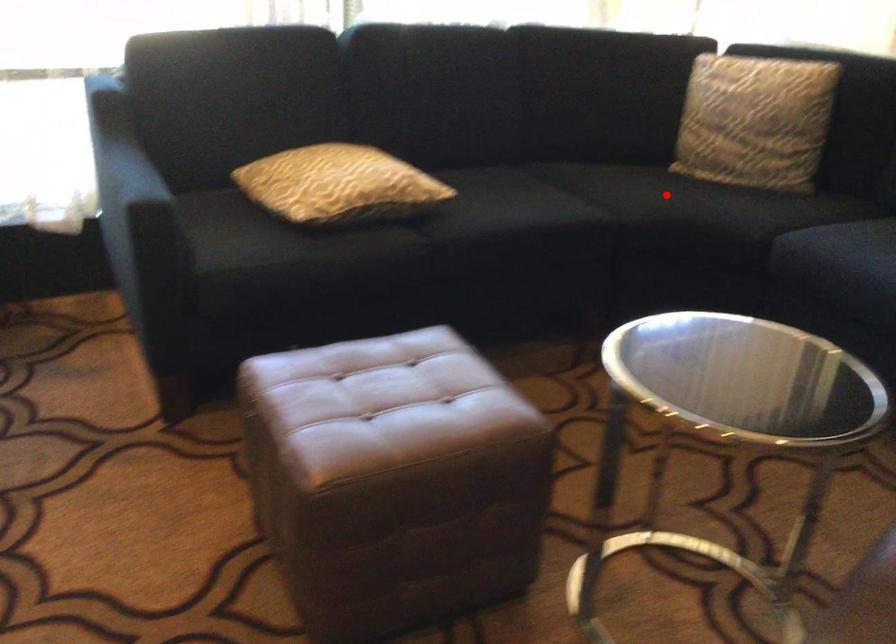
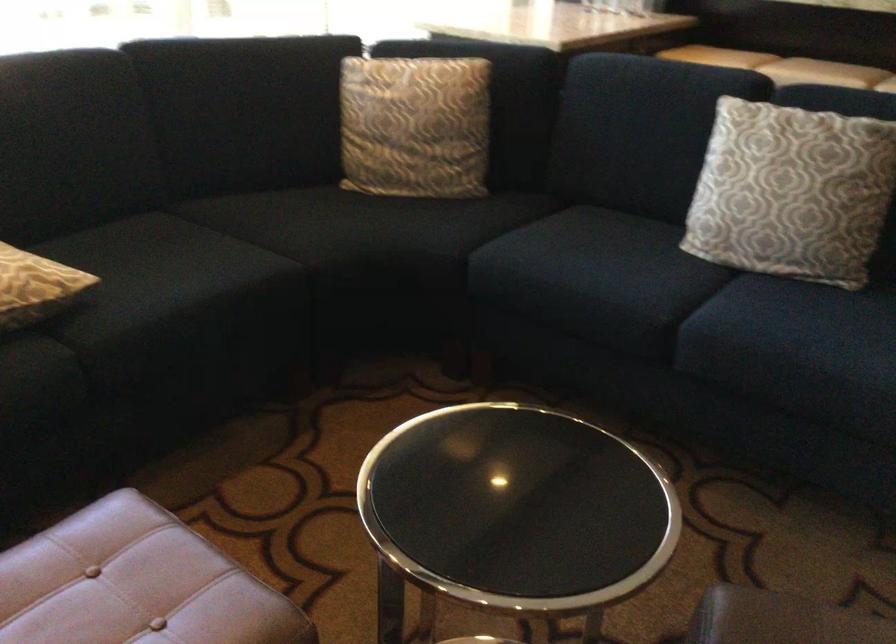
In the second image, find the point that corresponds to the highlighted location in the first image.

(348, 227)